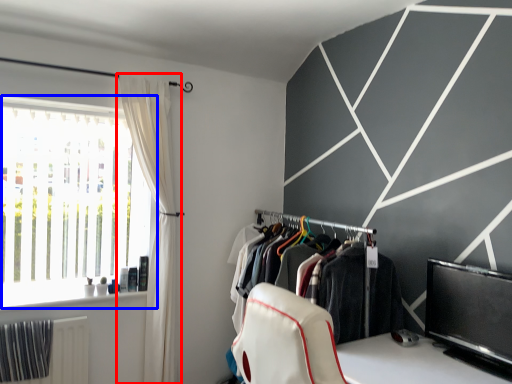
Question: Which point is further to the camera, curtain (highlighted by a red box) or window (highlighted by a blue box)?

Choices:
 (A) curtain
 (B) window

Answer: (A)